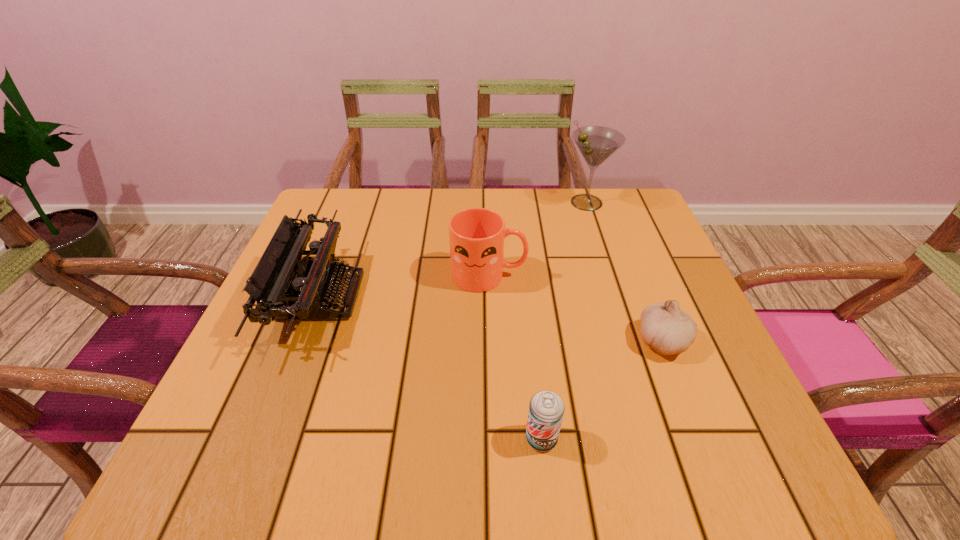
The height and width of the screenshot is (540, 960). I want to click on the tallest object, so click(596, 144).

The height and width of the screenshot is (540, 960). What are the coordinates of `martini` in the screenshot? It's located at (596, 144).

This screenshot has width=960, height=540. I want to click on mug, so click(x=476, y=235).

Find the location of `the leftmost object`. the leftmost object is located at coordinates (312, 280).

This screenshot has width=960, height=540. Identify the location of garlic. (667, 329).

The height and width of the screenshot is (540, 960). What are the coordinates of `the nearest object` in the screenshot? It's located at coord(546,409).

At what (x,y) coordinates should I click in order to perform the action: click on free space located 0.200m on the left of the tallest object. Please return your answer as a coordinate pair (x, y). Looking at the image, I should click on (492, 202).

Locate an element on the screen. The height and width of the screenshot is (540, 960). vacant region located 0.130m on the handle side of the mug is located at coordinates (583, 275).

Where is `vacant region located 0.170m on the typing side of the leftmost object`? vacant region located 0.170m on the typing side of the leftmost object is located at coordinates (437, 297).

This screenshot has height=540, width=960. Identify the location of vacant region located on the left of the garlic. (564, 341).